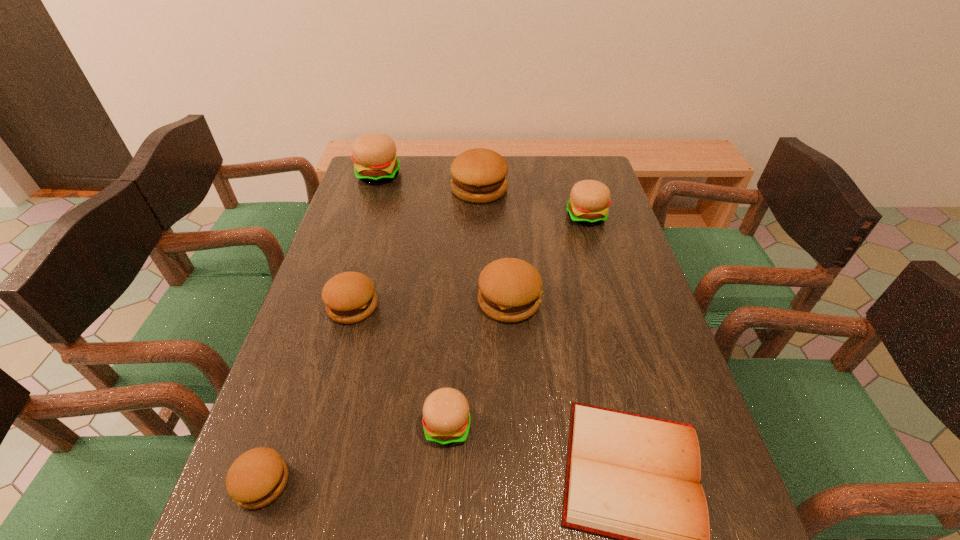
Locate an element on the screen. The width and height of the screenshot is (960, 540). the smallest brown hamburger is located at coordinates pyautogui.click(x=256, y=478).

Where is `vacant region located on the right of the biggest beige hamburger`? Image resolution: width=960 pixels, height=540 pixels. vacant region located on the right of the biggest beige hamburger is located at coordinates (443, 176).

Where is `free spot located 0.260m on the front of the farthest brown hamburger`? Image resolution: width=960 pixels, height=540 pixels. free spot located 0.260m on the front of the farthest brown hamburger is located at coordinates (479, 258).

At what (x,y) coordinates should I click in order to perform the action: click on vacant region located 0.070m on the left of the rightmost hamburger. Please return your answer as a coordinate pair (x, y). Image resolution: width=960 pixels, height=540 pixels. Looking at the image, I should click on point(544,217).

I want to click on free space located 0.260m on the left of the third smallest brown hamburger, so click(x=378, y=301).

At what (x,y) coordinates should I click in order to perform the action: click on free point located 0.110m on the front of the third biggest brown hamburger. Please return your answer as a coordinate pair (x, y). Image resolution: width=960 pixels, height=540 pixels. Looking at the image, I should click on (337, 363).

Image resolution: width=960 pixels, height=540 pixels. I want to click on free space located 0.090m on the front of the nearest beige hamburger, so click(444, 497).

The width and height of the screenshot is (960, 540). I want to click on free spot located on the back of the smallest brown hamburger, so click(295, 389).

I want to click on object that is at the right edge, so click(x=589, y=199).

This screenshot has width=960, height=540. In order to click on object that is at the far left corner in this screenshot , I will do `click(374, 154)`.